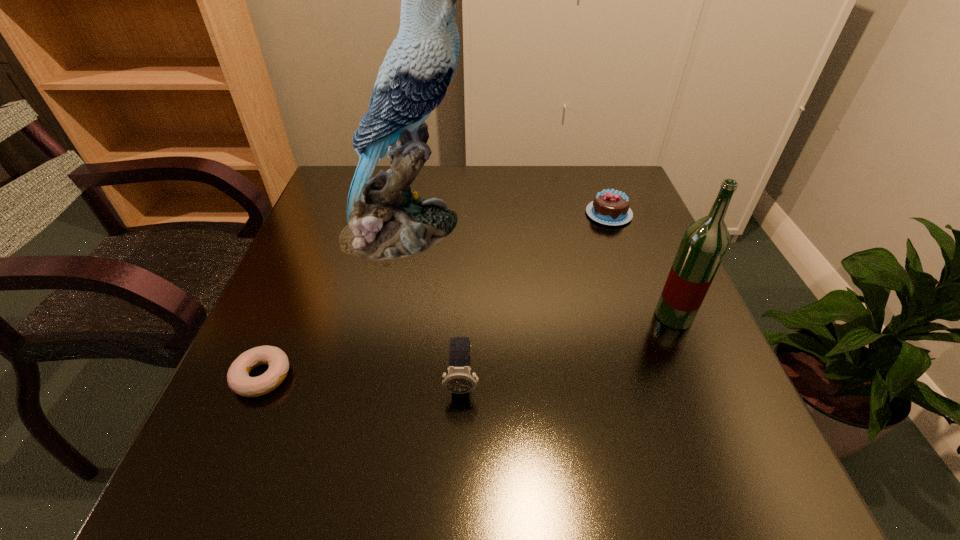
I want to click on vacant space at the near edge of the desktop, so click(x=653, y=469).

Identify the location of vacant region at the left edge. This screenshot has height=540, width=960. (300, 334).

In the image, there is a desktop. Where is `free space at the right edge`? free space at the right edge is located at coordinates (673, 356).

The image size is (960, 540). Find the location of `vacant space at the far left corner`. vacant space at the far left corner is located at coordinates (324, 185).

In order to click on free spot at the near left corner of the desktop in this screenshot , I will do `click(270, 469)`.

I want to click on vacant space at the far right corner of the desktop, so click(x=585, y=202).

Identify the location of vacant space at the near right corner of the desktop. (698, 494).

The height and width of the screenshot is (540, 960). In order to click on blank region between the chocolate cake and the shortest object in this screenshot , I will do `click(436, 295)`.

The width and height of the screenshot is (960, 540). Identify the location of free spot between the doughnut and the third shortest object. (362, 379).

This screenshot has height=540, width=960. In order to click on unoccupied area between the doughnut and the parakeet in this screenshot , I will do [333, 303].